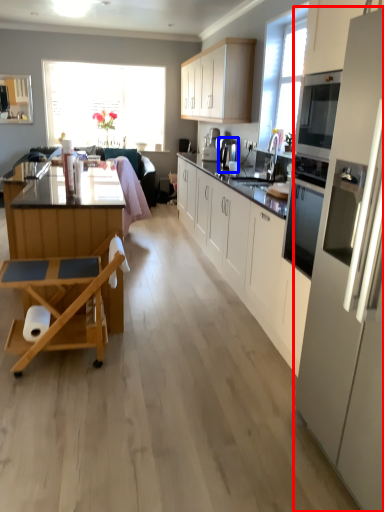
Question: Which of the following is the closest to the observer, kitchen appliance (highlighted by a red box) or coffee machine (highlighted by a blue box)?

Choices:
 (A) kitchen appliance
 (B) coffee machine

Answer: (A)